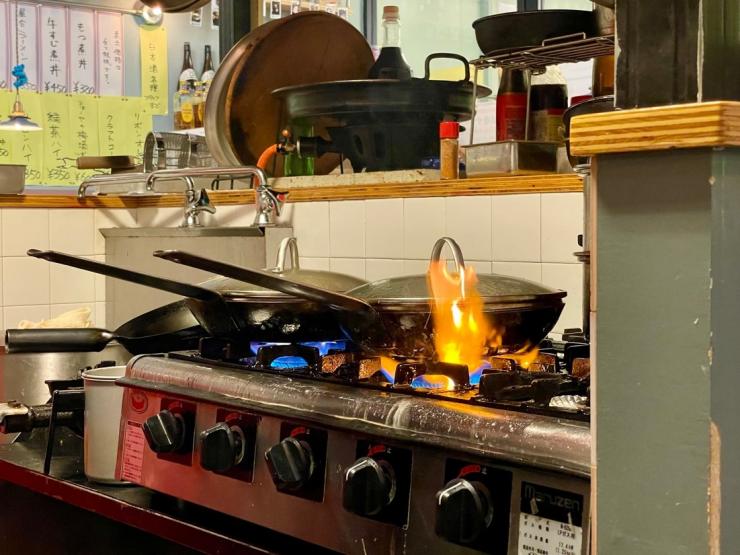
At what (x,y) coordinates should I click in order to perform the action: click on wall. Please return your answer as a coordinate pair (x, y). Looking at the image, I should click on (645, 398).